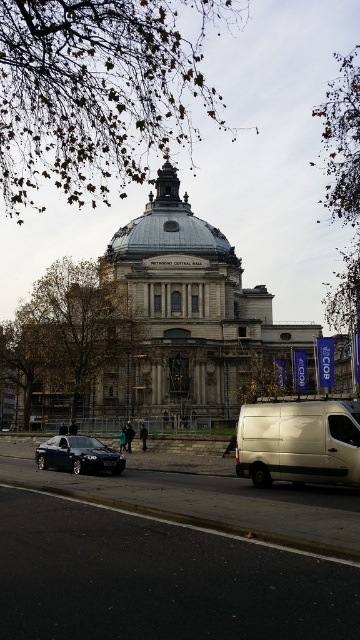
Question: Which point is closer to the camera?

Choices:
 (A) silver metallic dome at center
 (B) shiny black sedan at lower left

Answer: (B)

Question: Can you confirm if silver metallic dome at center is positioned to the left of shiny black sedan at lower left?

Choices:
 (A) yes
 (B) no

Answer: (B)

Question: Is silver metallic dome at center above shiny black sedan at lower left?

Choices:
 (A) no
 (B) yes

Answer: (B)

Question: Considering the relative positions of silver metallic van at lower right and silver metallic dome at center in the image provided, where is silver metallic van at lower right located with respect to silver metallic dome at center?

Choices:
 (A) below
 (B) above

Answer: (A)

Question: Among these objects, which one is nearest to the camera?

Choices:
 (A) silver metallic van at lower right
 (B) silver metallic dome at center
 (C) shiny black sedan at lower left

Answer: (A)

Question: Which of the following is the farthest from the observer?

Choices:
 (A) (38, 467)
 (B) (208, 230)

Answer: (B)